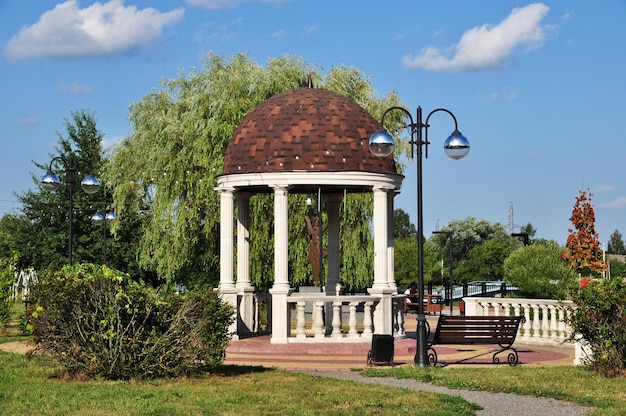
Identify the location of pillars. (225, 259), (242, 257), (279, 260), (332, 258), (372, 259), (387, 258).